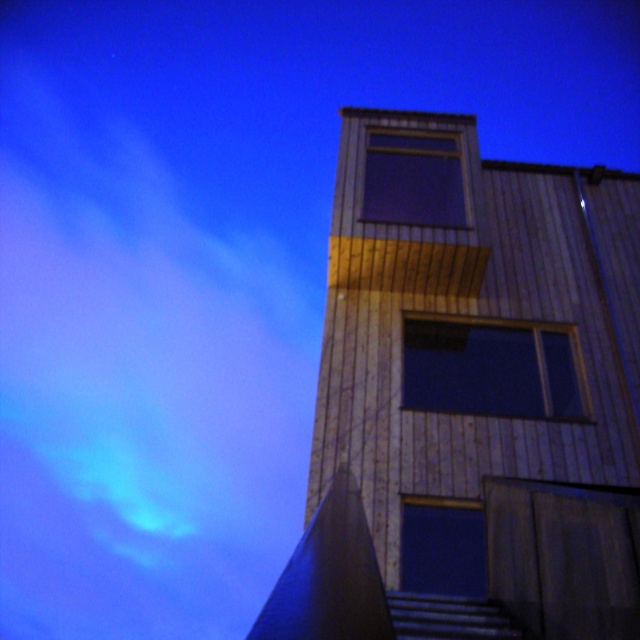
Does point (432, 180) lie in front of point (570, 412)?

No.

Describe the element at coordinates (483, 378) in the screenshot. This screenshot has width=640, height=640. I see `wooden tower at center` at that location.

Does point (435, 368) lie behind point (573, 381)?

No, it is not.

The width and height of the screenshot is (640, 640). In order to click on wooden tower at center in this screenshot , I will do `click(483, 378)`.

Looking at this image, is transparent glass window at upper center taller than dark glass window at center?

Yes.

Is transparent glass window at upper center positioned behind dark glass window at center?

Yes, it is behind dark glass window at center.

Which is behind, point (364, 189) or point (461, 554)?

Point (364, 189)

The image size is (640, 640). In order to click on transparent glass window at upper center in this screenshot , I will do `click(413, 179)`.

Can you confirm if wooden tower at center is bigger than dark glass window at center?

Yes, wooden tower at center is bigger than dark glass window at center.

Does point (339, 230) come farther from viewer compared to point (440, 506)?

Yes.

Where is `wooden tower at center`? wooden tower at center is located at coordinates (483, 378).